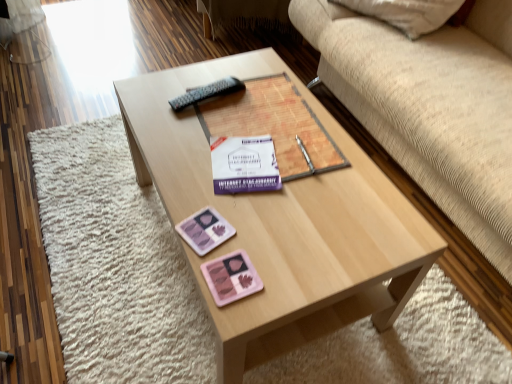
This screenshot has height=384, width=512. Find the location of `unoccupied space behind pink matte eyeshadow palette at center, arranged as the second currency when ordered from the bottom`. unoccupied space behind pink matte eyeshadow palette at center, arranged as the second currency when ordered from the bottom is located at coordinates (198, 190).